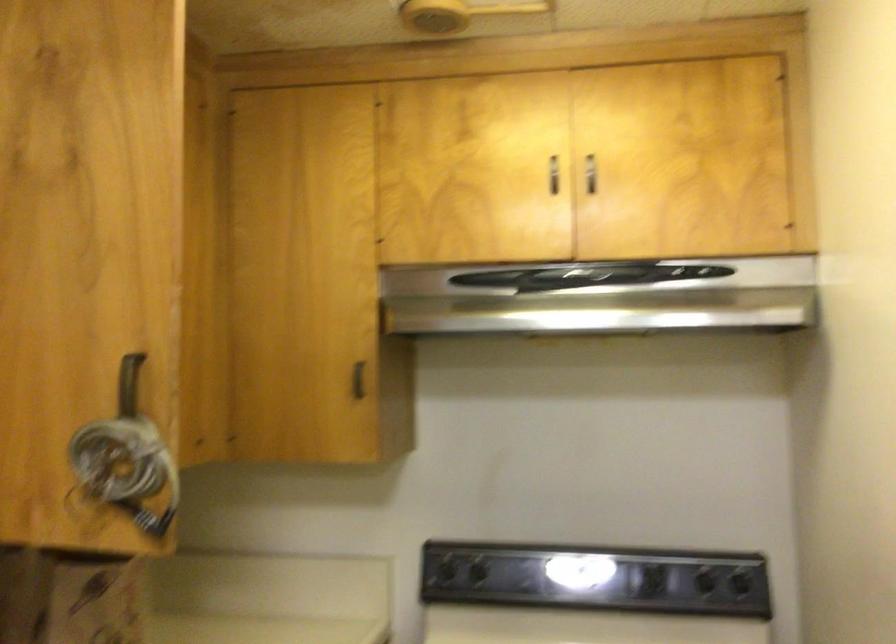
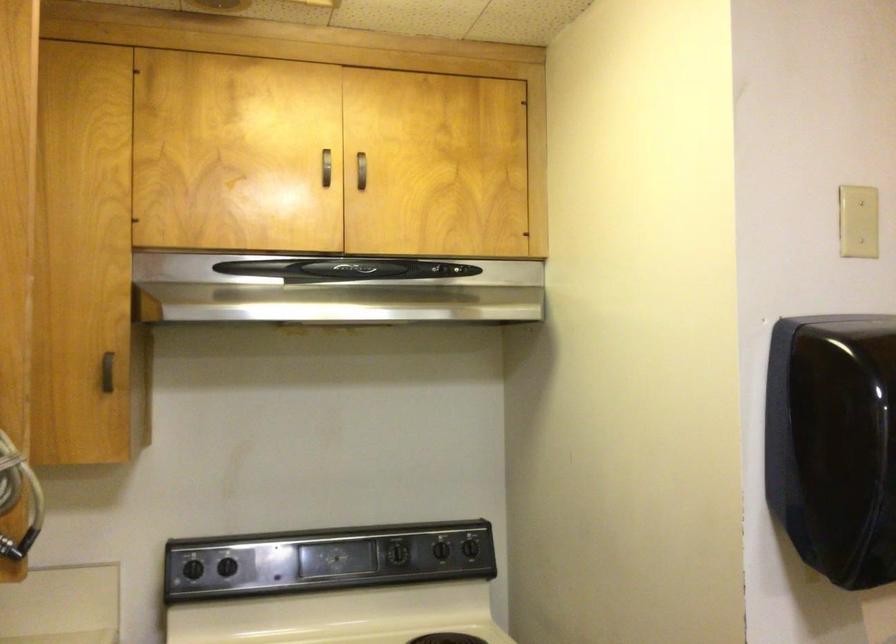
Locate, in the second image, the point that corresponds to the point at 581,275 in the first image.

(345, 269)